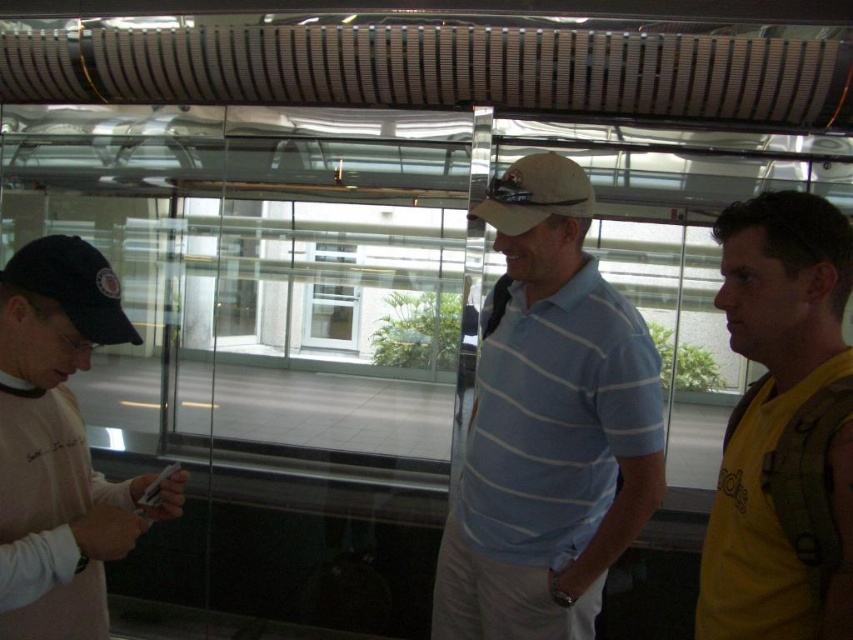
Is light blue striped polo shirt at center above black fabric baseball cap at left?

No.

Is light blue striped polo shirt at center to the right of black fabric baseball cap at left from the viewer's perspective?

Indeed, light blue striped polo shirt at center is positioned on the right side of black fabric baseball cap at left.

Which is behind, point (558, 420) or point (83, 337)?

Positioned behind is point (558, 420).

In order to click on light blue striped polo shirt at center in this screenshot , I will do point(548,426).

Between yellow fabric shirt at right and matte khaki baseball cap at center, which one appears on the left side from the viewer's perspective?

matte khaki baseball cap at center is more to the left.

Between yellow fabric shirt at right and matte khaki baseball cap at center, which one has less height?

matte khaki baseball cap at center is shorter.

Where is `yellow fabric shirt at right`? This screenshot has width=853, height=640. yellow fabric shirt at right is located at coordinates (782, 428).

This screenshot has width=853, height=640. Identify the location of yellow fabric shirt at right. (782, 428).

What do you see at coordinates (548, 426) in the screenshot?
I see `light blue striped polo shirt at center` at bounding box center [548, 426].

Does light blue striped polo shirt at center have a lesser height compared to matte khaki baseball cap at center?

Incorrect, light blue striped polo shirt at center's height does not fall short of matte khaki baseball cap at center's.

Identify the location of light blue striped polo shirt at center. Image resolution: width=853 pixels, height=640 pixels. (548, 426).